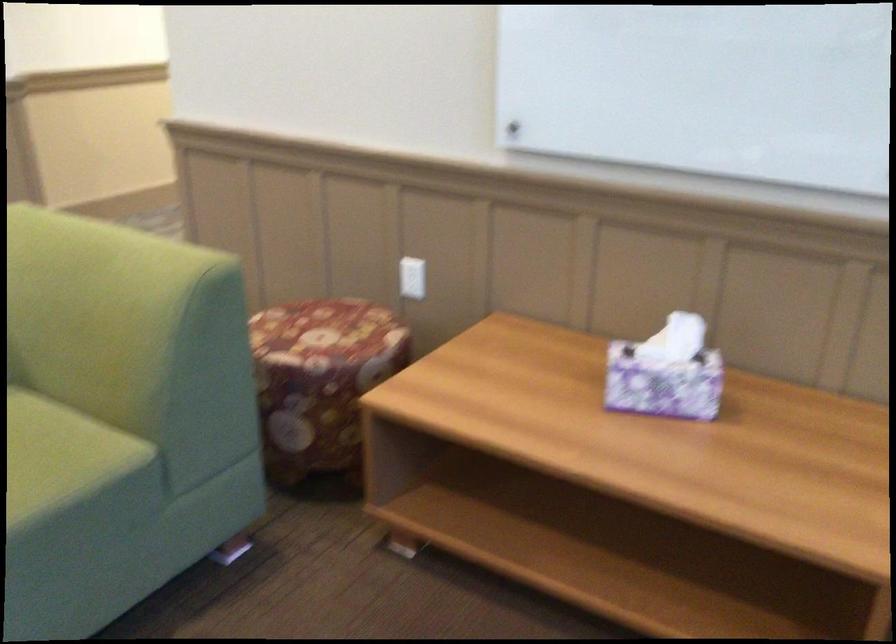
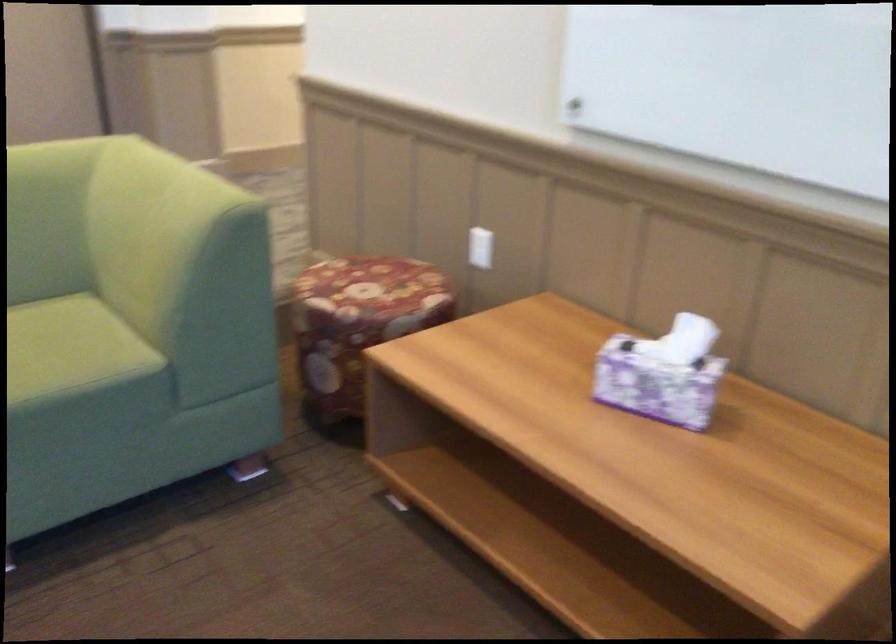
Find the pixel in the second image that matches [416,278] in the first image.

(479, 247)